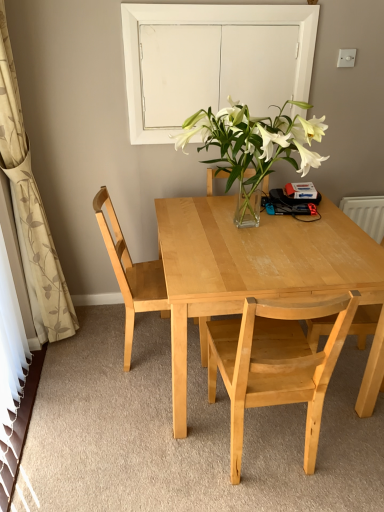
At what (x,y) coordinates should I click in order to perform the action: click on vacant space situated on the left part of light wood chair at center, which is the second chair in right-to-left order. Please return your answer as a coordinate pair (x, y). This screenshot has height=512, width=384. Looking at the image, I should click on (160, 448).